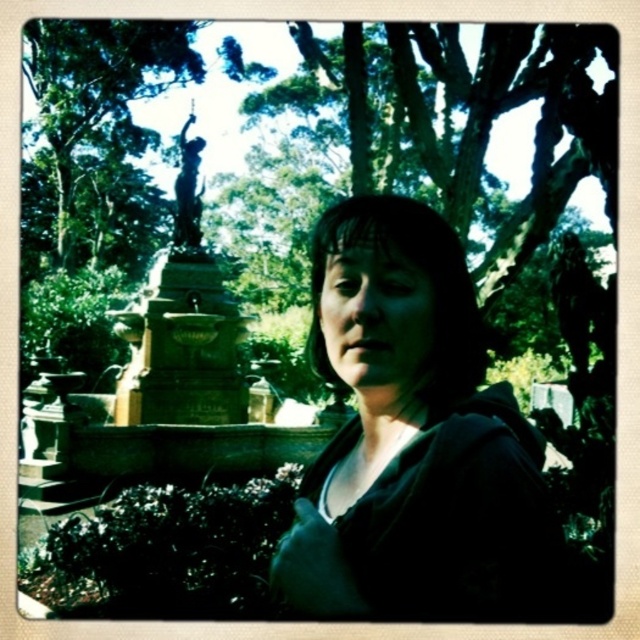
Between point (378, 244) and point (413, 385), which one is positioned in front?

Point (378, 244) is in front.

Does point (525, 564) come closer to viewer compared to point (349, 339)?

Yes, it is.

Where is `black matte hoodie at center`? This screenshot has width=640, height=640. black matte hoodie at center is located at coordinates (412, 436).

The image size is (640, 640). Identify the location of black matte hoodie at center. (412, 436).

Does green leafy tree at upper left lie in front of matte black face at center?

That is False.

Can you confirm if green leafy tree at upper left is taller than matte black face at center?

Correct, green leafy tree at upper left is much taller as matte black face at center.

Is point (24, 168) less distant than point (349, 356)?

That is False.

This screenshot has width=640, height=640. I want to click on green leafy tree at upper left, so click(97, 138).

Who is more distant from viewer, (460, 380) or (189, 115)?

Point (189, 115)

Where is `black matte hoodie at center`? This screenshot has width=640, height=640. black matte hoodie at center is located at coordinates click(x=412, y=436).